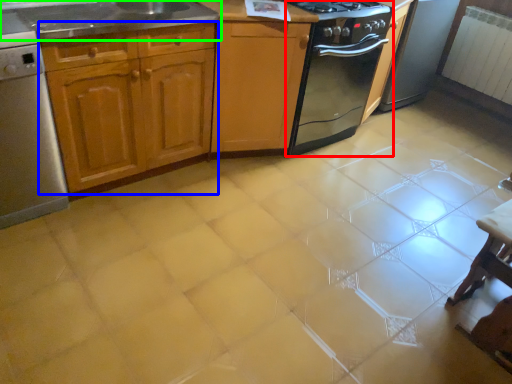
Question: Considering the real-world distances, which object is closest to kitchen appliance (highlighted by a red box)? cabinetry (highlighted by a blue box) or countertop (highlighted by a green box).

Choices:
 (A) cabinetry
 (B) countertop

Answer: (A)